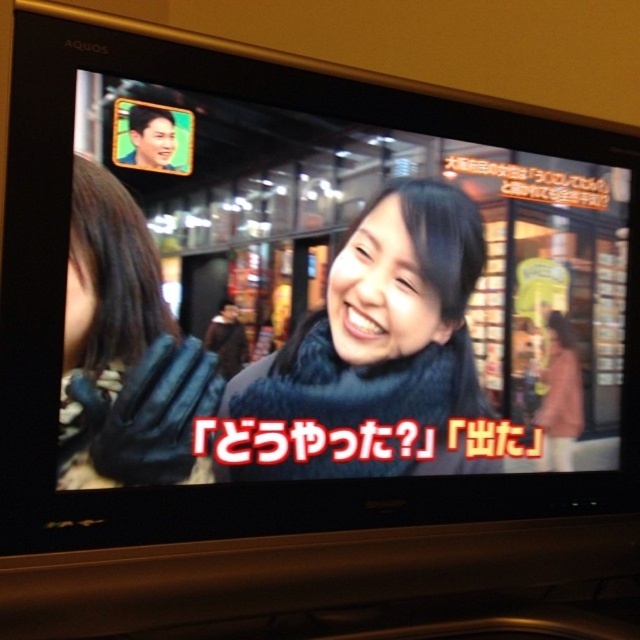
Between blue fuzzy scarf at center and blue fuzzy gloves at left, which one appears on the left side from the viewer's perspective?

blue fuzzy gloves at left

Can you confirm if blue fuzzy scarf at center is shorter than blue fuzzy gloves at left?

No, blue fuzzy scarf at center is not shorter than blue fuzzy gloves at left.

Where is `blue fuzzy scarf at center`? blue fuzzy scarf at center is located at coordinates (381, 337).